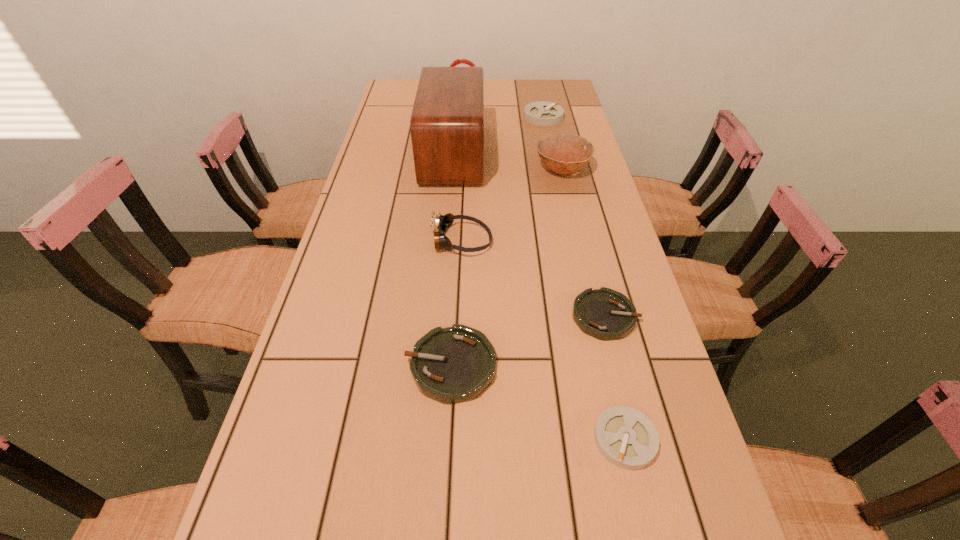
This screenshot has width=960, height=540. I want to click on radio receiver, so click(447, 122).

This screenshot has height=540, width=960. I want to click on red watch, so click(457, 61).

I want to click on the seventh shortest object, so click(457, 61).

The image size is (960, 540). Find the location of `bowl`. bowl is located at coordinates (562, 153).

At what (x,y) coordinates should I click in order to perform the action: click on brown bowl. Please return your answer as a coordinate pair (x, y). Looking at the image, I should click on (562, 153).

Image resolution: width=960 pixels, height=540 pixels. Identify the location of bronze goggles. (442, 222).

The image size is (960, 540). What are the coordinates of `the fifth shortest object` in the screenshot? It's located at (442, 222).

In order to click on the farthest ashtray in this screenshot , I will do `click(541, 113)`.

Identify the location of the tallest ashtray. This screenshot has width=960, height=540. (541, 113).

Find the location of a particular element. The image size is (960, 540). the left green ashtray is located at coordinates (451, 365).